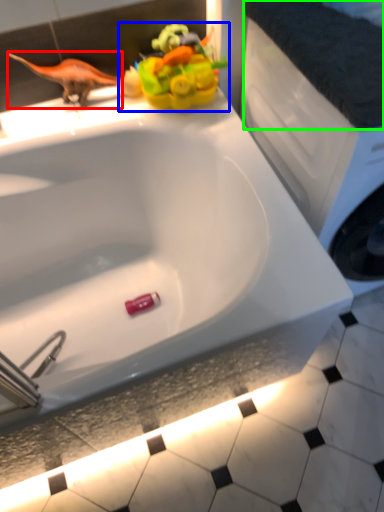
Question: Which is farther away from animal (highlighted by a red box)? toy (highlighted by a blue box) or counter top (highlighted by a green box)?

Choices:
 (A) toy
 (B) counter top

Answer: (B)